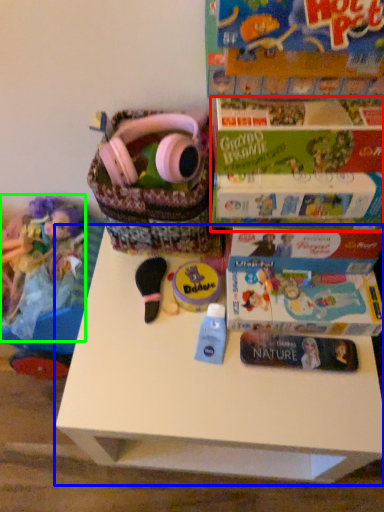
Question: Which object is positioned closest to paperback book (highlighted by a red box)? Select from table (highlighted by a blue box) and doll (highlighted by a green box).

Choices:
 (A) table
 (B) doll

Answer: (A)